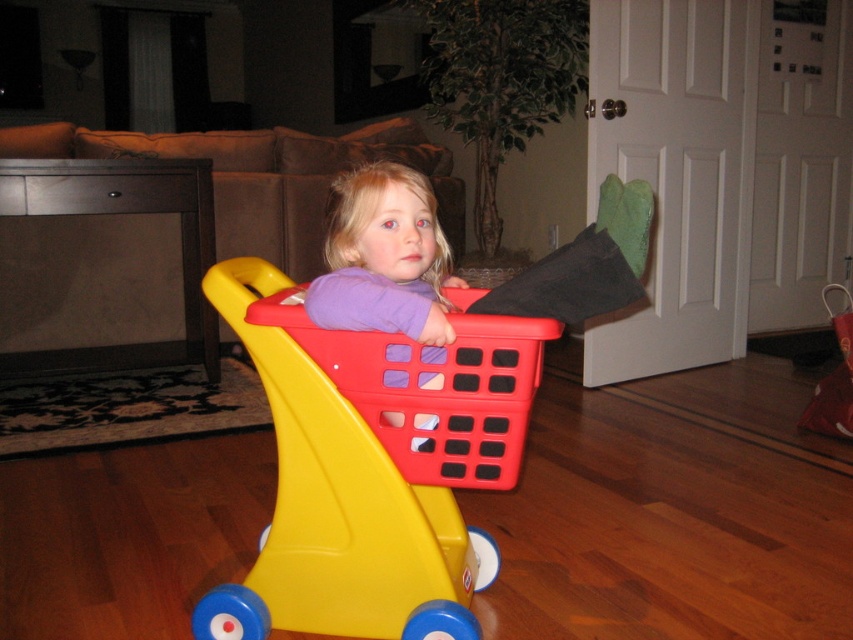
You are a delivery robot in a home. You need to deliver a package to the sofa with brown cushions in the background. The matte plastic shopping cart at center is in your way. Can you move around it to reach the sofa?

The matte plastic shopping cart at center is located at point (370,472). Since the sofa is in the background, you can move around the shopping cart to reach it.

Based on the photo, you are a parent trying to move the matte plastic shopping cart at center and the red plastic basket at center into a storage area. The storage area has a narrow doorway that only allows items to pass through one at a time. Based on their positions, which item should you move first?

The matte plastic shopping cart at center is to the left of the red plastic basket at center. Since the storage doorway allows only one item at a time, you should move the matte plastic shopping cart at center first as it is positioned closer to the left side and likely closer to the doorway entrance.

You are a parent trying to put your child into the matte plastic shopping cart at center. The red plastic basket at center is in the way. Can you remove the basket to make more space?

The matte plastic shopping cart at center is taller than the red plastic basket at center, so you can remove the red plastic basket at center to make more space since it is shorter and easier to move.